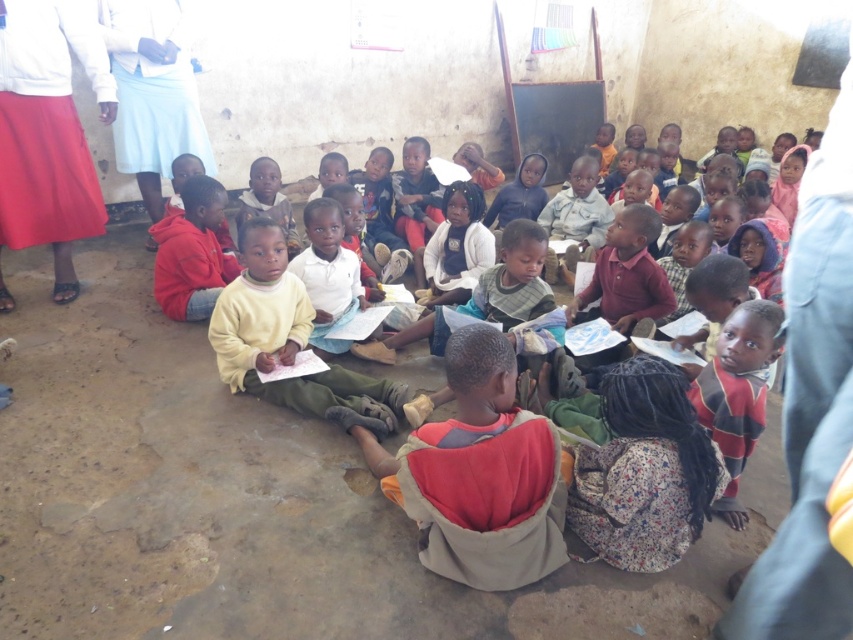
Question: Is white fabric skirt at upper left thinner than striped wool sweater at lower right?

Choices:
 (A) yes
 (B) no

Answer: (B)

Question: Which object appears closest to the camera in this image?

Choices:
 (A) yellow cotton shirt at center
 (B) blue denim jacket at upper right
 (C) striped wool sweater at lower right
 (D) white fabric skirt at upper left

Answer: (B)

Question: Which of the following is the closest to the observer?

Choices:
 (A) (61, 244)
 (B) (167, 26)
 (C) (744, 460)
 (D) (672, 196)

Answer: (C)

Question: Is blue denim jacket at upper right closer to the viewer compared to white fabric skirt at upper left?

Choices:
 (A) no
 (B) yes

Answer: (B)

Question: Which object appears farthest from the camera in this image?

Choices:
 (A) striped wool sweater at lower right
 (B) yellow cotton shirt at center

Answer: (B)

Question: Observing the image, what is the correct spatial positioning of white fabric skirt at upper left in reference to yellow cotton shirt at center?

Choices:
 (A) below
 (B) above

Answer: (B)